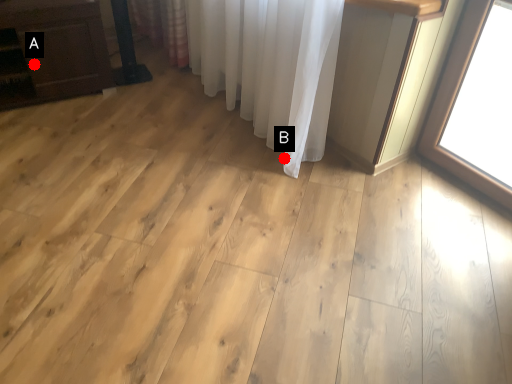
Question: Two points are circled on the image, labeled by A and B beside each circle. Among these points, which one is nearest to the camera?

Choices:
 (A) A is closer
 (B) B is closer

Answer: (B)